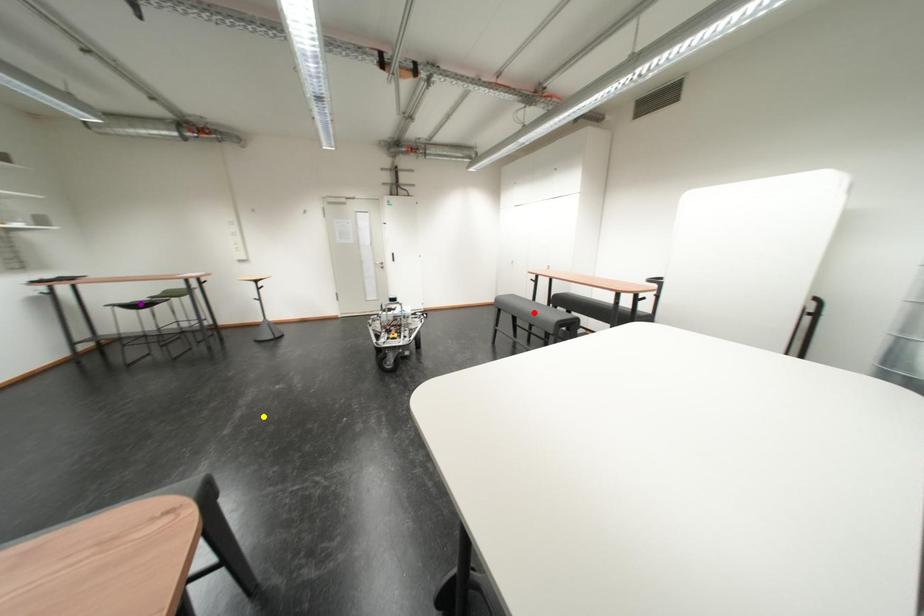
Order these from nearest to farthest:
red point, yellow point, purple point

yellow point
purple point
red point